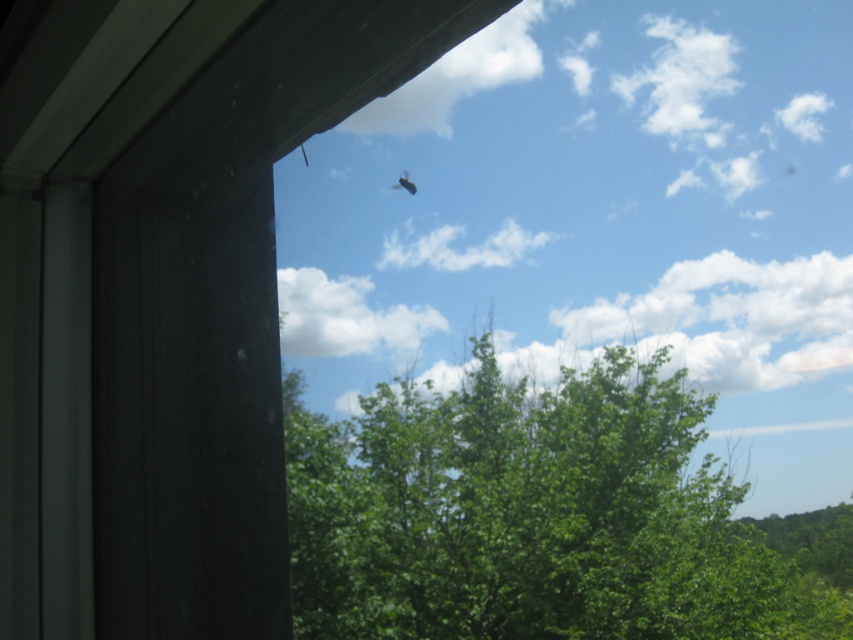
Who is higher up, green leafy tree at center or black matte bird at upper center?

Positioned higher is black matte bird at upper center.

At what (x,y) coordinates should I click in order to perform the action: click on green leafy tree at center. Please return your answer as a coordinate pair (x, y). Looking at the image, I should click on (544, 515).

Is point (735, 557) positioned before point (401, 180)?

Yes.

The height and width of the screenshot is (640, 853). What are the coordinates of `green leafy tree at center` in the screenshot? It's located at (544, 515).